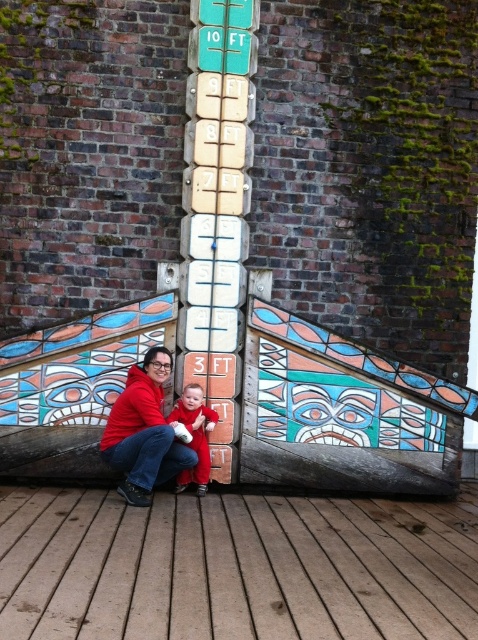
In the scene shown: You are standing on the wooden deck in front of the totem pole. You notice two red items on the deck. Which one is higher up, the red hoodie at lower center or the matte red onesie at center?

The red hoodie at lower center is above the matte red onesie at center, so it is higher up.

You are standing on the wooden deck in front of the totem pole and see the red hoodie at lower center and the matte red onesie at center. Which clothing item is positioned more to the right?

The matte red onesie at center is positioned more to the right than the red hoodie at lower center.

You are standing on the wooden deck in front of the totem pole. You see a red hoodie at lower center and a matte red onesie at center. Which item is nearer to you?

The red hoodie at lower center is closer to the viewer than the matte red onesie at center, so the red hoodie at lower center is nearer to you.